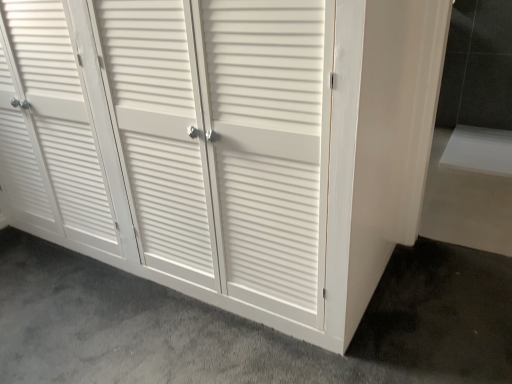
This screenshot has width=512, height=384. What do you see at coordinates (248, 325) in the screenshot?
I see `white matte cabinet at center` at bounding box center [248, 325].

Locate an element on the screen. The width and height of the screenshot is (512, 384). white matte cabinet at center is located at coordinates point(248,325).

Identify the location of white matte cabinet at center. The height and width of the screenshot is (384, 512). (248, 325).